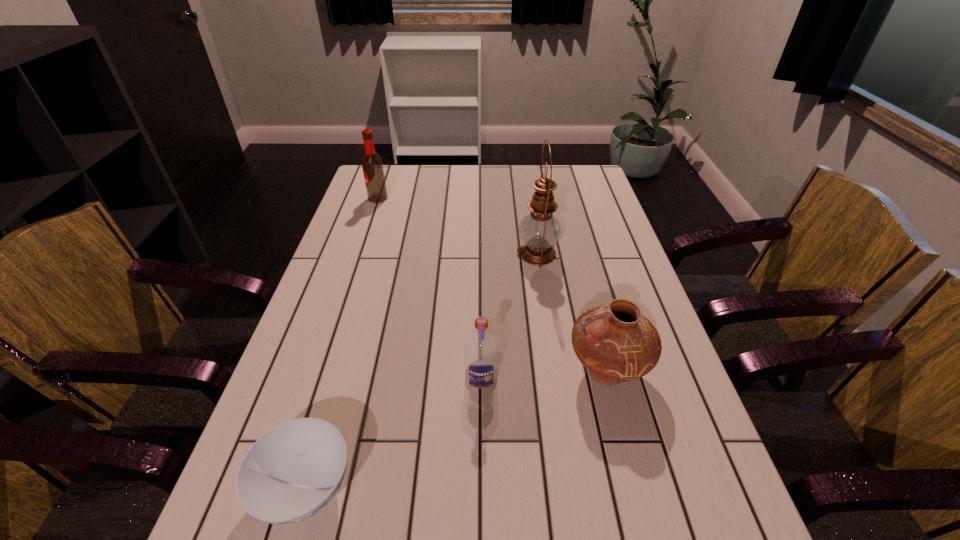
The height and width of the screenshot is (540, 960). I want to click on vacant space that satisfies the following two spatial constraints: 1. on the front side of the farthest object; 2. on the left side of the fourth nearest object, so click(x=359, y=254).